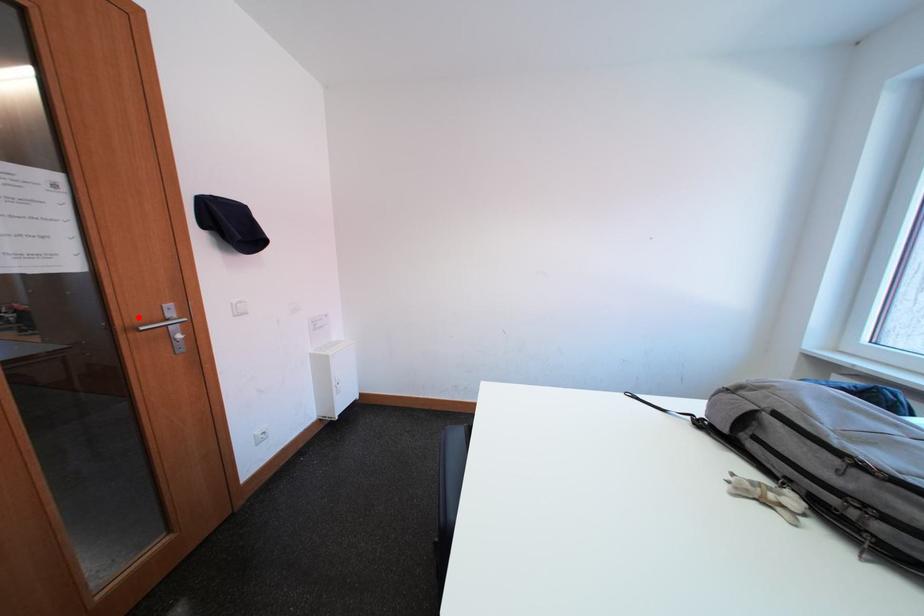
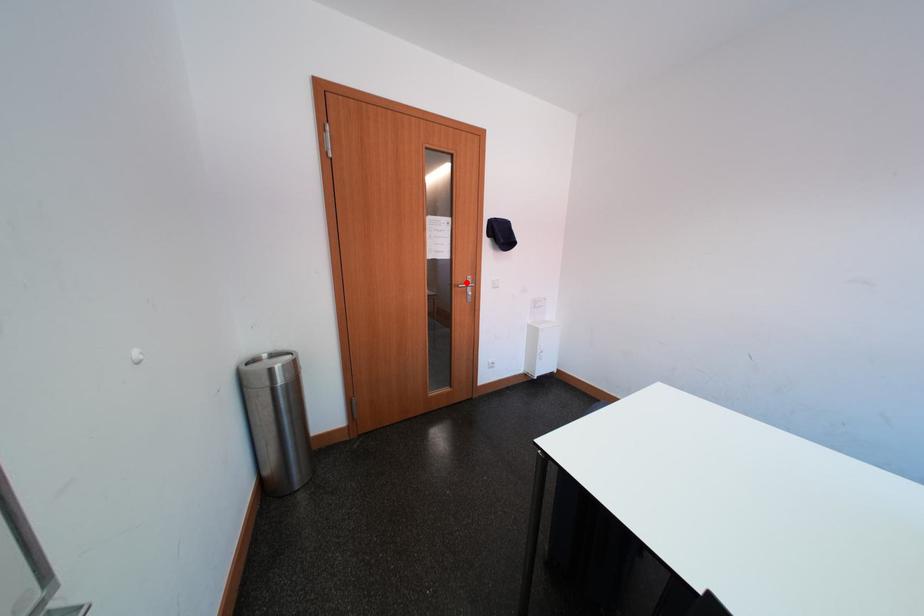
I am providing you with two images of the same scene from different viewpoints. A red point is marked on the first image and another point is marked on the second image. Does the point marked in image1 correspond to the same location as the one in image2?

Yes